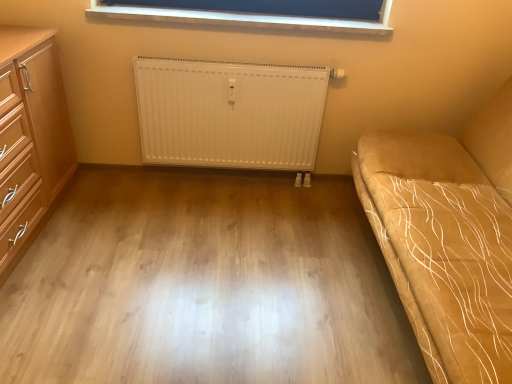
Question: From the image's perspective, is suede-like beige studio couch at right over light wood floor at center?

Choices:
 (A) yes
 (B) no

Answer: (A)

Question: Does suede-like beige studio couch at right have a greater width compared to light wood floor at center?

Choices:
 (A) yes
 (B) no

Answer: (B)

Question: From a real-world perspective, is suede-like beige studio couch at right physically below light wood floor at center?

Choices:
 (A) no
 (B) yes

Answer: (A)

Question: Is there a large distance between suede-like beige studio couch at right and light wood floor at center?

Choices:
 (A) yes
 (B) no

Answer: (B)

Question: Is suede-like beige studio couch at right thinner than light wood floor at center?

Choices:
 (A) no
 (B) yes

Answer: (B)

Question: Is suede-like beige studio couch at right oriented towards light wood floor at center?

Choices:
 (A) no
 (B) yes

Answer: (B)

Question: Is light wood/wooden chest of drawers at left facing towards light wood floor at center?

Choices:
 (A) yes
 (B) no

Answer: (A)

Question: Can you confirm if light wood/wooden chest of drawers at left is thinner than light wood floor at center?

Choices:
 (A) yes
 (B) no

Answer: (A)

Question: Is the position of light wood/wooden chest of drawers at left less distant than that of light wood floor at center?

Choices:
 (A) no
 (B) yes

Answer: (B)

Question: Does light wood/wooden chest of drawers at left have a smaller size compared to light wood floor at center?

Choices:
 (A) yes
 (B) no

Answer: (B)

Question: Is the depth of light wood/wooden chest of drawers at left greater than that of light wood floor at center?

Choices:
 (A) no
 (B) yes

Answer: (A)

Question: Does light wood/wooden chest of drawers at left have a lesser height compared to light wood floor at center?

Choices:
 (A) no
 (B) yes

Answer: (A)

Question: From a real-world perspective, is white ribbed radiator at center on top of light wood floor at center?

Choices:
 (A) yes
 (B) no

Answer: (A)